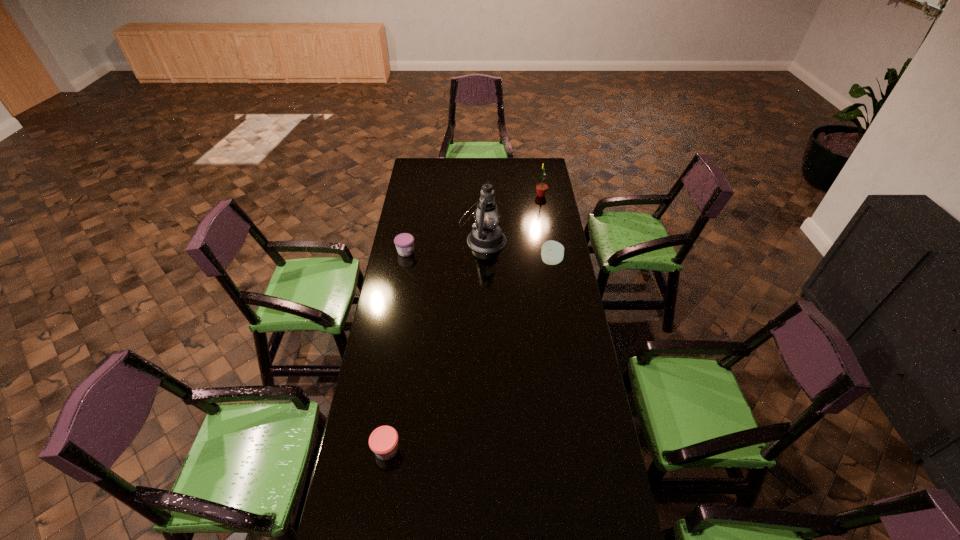
I want to click on vacant space that satisfies the following two spatial constraints: 1. on the front side of the third object from right to left; 2. on the right side of the third shortest object, so click(484, 261).